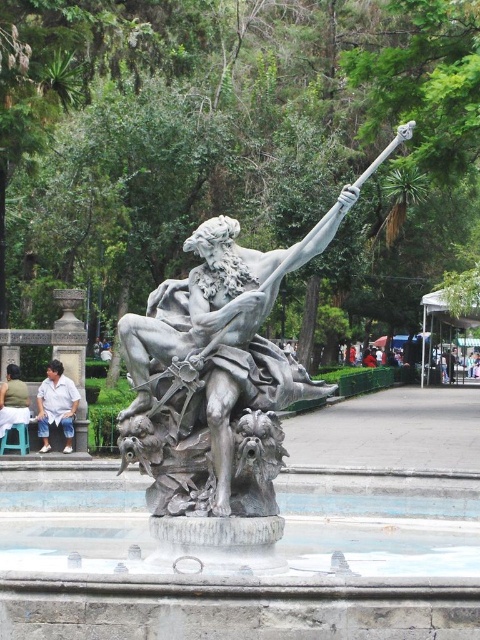
You are a photographer standing at the camera position. You want to take a closeup photo of the bronze statue at center. Given that your camera has a maximum zoom range of 50 meters, can you capture the statue clearly?

The bronze statue at center is 27.44 meters away from the camera. Since your camera can zoom up to 50 meters, which is farther than the statue distance, you can capture the statue clearly.

Based on the photo, you are a photographer trying to capture the statue in the park. You notice the light blue jeans at lower left and the light brown fabric shirt at center in the foreground. Which clothing item is covering part of the other in the image?

The light blue jeans at lower left is positioned over the light brown fabric shirt at center, so the jeans are covering part of the shirt in the image.